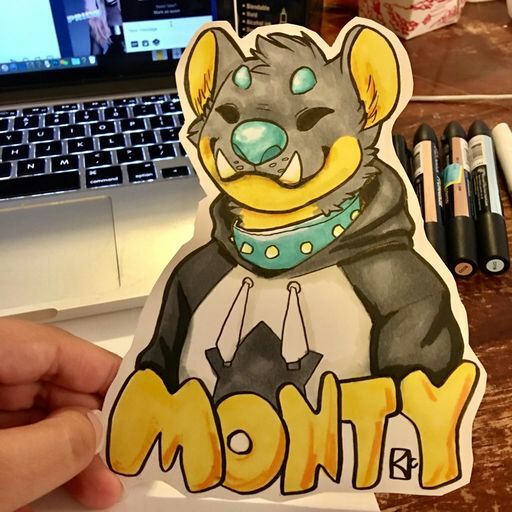
Where is `laptop`? Image resolution: width=512 pixels, height=512 pixels. laptop is located at coordinates (87, 83).